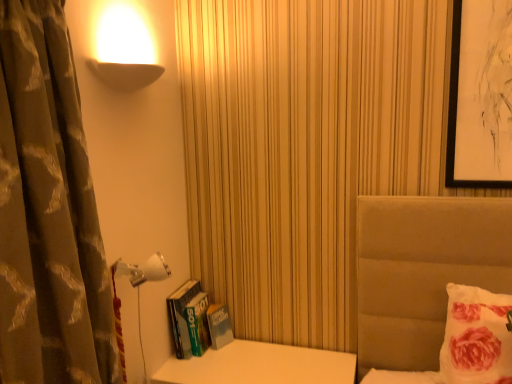
You are a GUI agent. You are given a task and a screenshot of the screen. Output one action in this format:
    pyautogui.click(x=<x>, y=<y>)
    Task: Click on the fluffy white pillow at right
    Image resolution: width=512 pixels, height=384 pixels.
    Given the screenshot: What is the action you would take?
    pyautogui.click(x=476, y=337)

The height and width of the screenshot is (384, 512). Describe the element at coordinates (142, 270) in the screenshot. I see `white plastic lamp at lower left` at that location.

The image size is (512, 384). Describe the element at coordinates (48, 212) in the screenshot. I see `brown textured curtain at left` at that location.

Locate an element on the screen. The height and width of the screenshot is (384, 512). hardcover book at left is located at coordinates (198, 322).

Locate an element on the screen. Image resolution: width=512 pixels, height=384 pixels. lamp in front of the hardcover book at left is located at coordinates (142, 270).

In the scene shown: Based on their sizes in the image, would you say hardcover book at left is bigger or smaller than white plastic lamp at lower left?

Clearly, hardcover book at left is larger in size than white plastic lamp at lower left.

Consider the image. How many degrees apart are the facing directions of hardcover book at left and white plastic lamp at lower left?

The angle between the facing direction of hardcover book at left and the facing direction of white plastic lamp at lower left is 90 degrees.

From the image's perspective, who appears lower, hardcover book at left or white plastic lamp at lower left?

From the image's view, hardcover book at left is below.

From the image's perspective, would you say brown textured curtain at left is positioned over fluffy white pillow at right?

Correct, brown textured curtain at left appears higher than fluffy white pillow at right in the image.

Is brown textured curtain at left wider or thinner than fluffy white pillow at right?

Considering their sizes, brown textured curtain at left looks broader than fluffy white pillow at right.

Is brown textured curtain at left to the left or to the right of fluffy white pillow at right in the image?

From the image, it's evident that brown textured curtain at left is to the left of fluffy white pillow at right.

Does white plastic lamp at lower left have a greater width compared to brown textured curtain at left?

No.

How distant is white plastic lamp at lower left from brown textured curtain at left?

white plastic lamp at lower left is 20.57 inches from brown textured curtain at left.

Between white plastic lamp at lower left and brown textured curtain at left, which one has smaller size?

Smaller between the two is white plastic lamp at lower left.

Is the surface of white plastic lamp at lower left in direct contact with brown textured curtain at left?

white plastic lamp at lower left and brown textured curtain at left are not in contact.

Is there a large distance between hardcover book at left and brown textured curtain at left?

That's not correct — hardcover book at left is a little close to brown textured curtain at left.

Is hardcover book at left oriented away from brown textured curtain at left?

No.

This screenshot has width=512, height=384. I want to click on book to the right of brown textured curtain at left, so click(x=198, y=322).

Which of these two, brown textured curtain at left or white glossy table at lower left, stands shorter?

white glossy table at lower left.

Visually, is brown textured curtain at left positioned to the left or to the right of white glossy table at lower left?

In the image, brown textured curtain at left appears on the left side of white glossy table at lower left.

Does brown textured curtain at left have a greater width compared to white glossy table at lower left?

In fact, brown textured curtain at left might be narrower than white glossy table at lower left.

Between brown textured curtain at left and white glossy table at lower left, which one is positioned behind?

white glossy table at lower left is further away from the camera.

Consider the image. Does hardcover book at left touch white glossy table at lower left?

hardcover book at left and white glossy table at lower left are clearly separated.

In the image, is hardcover book at left positioned in front of or behind white glossy table at lower left?

Visually, hardcover book at left is located behind white glossy table at lower left.

From a real-world perspective, which is physically above, hardcover book at left or white glossy table at lower left?

hardcover book at left.

In the scene shown: Can you tell me how much hardcover book at left and white glossy table at lower left differ in facing direction?

They differ by 0.00026 degrees in their facing directions.

Is fluffy white pillow at right thinner than white glossy table at lower left?

Yes, fluffy white pillow at right is thinner than white glossy table at lower left.

Which object is closer to the camera, fluffy white pillow at right or white glossy table at lower left?

fluffy white pillow at right.

Based on their sizes in the image, would you say fluffy white pillow at right is bigger or smaller than white glossy table at lower left?

Considering their sizes, fluffy white pillow at right takes up less space than white glossy table at lower left.

Locate an element on the screen. lamp that appears above the hardcover book at left (from the image's perspective) is located at coordinates (142, 270).

I want to click on curtain in front of the fluffy white pillow at right, so click(48, 212).

Based on their spatial positions, is white glossy table at lower left or fluffy white pillow at right closer to brown textured curtain at left?

Based on the image, white glossy table at lower left appears to be nearer to brown textured curtain at left.

Looking at the image, which one is located further to fluffy white pillow at right, hardcover book at left or brown textured curtain at left?

brown textured curtain at left is positioned further to the anchor fluffy white pillow at right.

Looking at the image, which one is located closer to brown textured curtain at left, hardcover book at left or fluffy white pillow at right?

hardcover book at left is positioned closer to the anchor brown textured curtain at left.

Considering their positions, is hardcover book at left positioned further to white glossy table at lower left than white plastic lamp at lower left?

Based on the image, white plastic lamp at lower left appears to be further to white glossy table at lower left.

Estimate the real-world distances between objects in this image. Which object is further from white plastic lamp at lower left, hardcover book at left or fluffy white pillow at right?

fluffy white pillow at right is further to white plastic lamp at lower left.

Based on their spatial positions, is brown textured curtain at left or white plastic lamp at lower left further from fluffy white pillow at right?

The object further to fluffy white pillow at right is brown textured curtain at left.

Estimate the real-world distances between objects in this image. Which object is further from white glossy table at lower left, fluffy white pillow at right or white plastic lamp at lower left?

fluffy white pillow at right lies further to white glossy table at lower left than the other object.

From the image, which object appears to be farther from white plastic lamp at lower left, white glossy table at lower left or brown textured curtain at left?

white glossy table at lower left is further to white plastic lamp at lower left.

Locate an element on the screen. The height and width of the screenshot is (384, 512). book between brown textured curtain at left and fluffy white pillow at right from left to right is located at coordinates (198, 322).

Where is `lamp between brown textured curtain at left and hardcover book at left along the z-axis`? The height and width of the screenshot is (384, 512). lamp between brown textured curtain at left and hardcover book at left along the z-axis is located at coordinates (142, 270).

The width and height of the screenshot is (512, 384). I want to click on lamp located between brown textured curtain at left and fluffy white pillow at right in the left-right direction, so click(x=142, y=270).

At what (x,y) coordinates should I click in order to perform the action: click on table located between brown textured curtain at left and hardcover book at left in the depth direction. Please return your answer as a coordinate pair (x, y). Image resolution: width=512 pixels, height=384 pixels. Looking at the image, I should click on (260, 366).